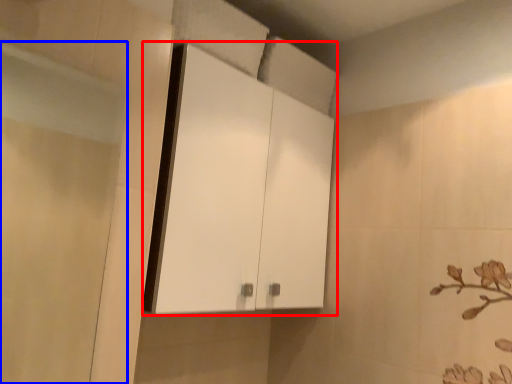
Question: Which of the following is the farthest to the observer, cabinetry (highlighted by a red box) or screen door (highlighted by a blue box)?

Choices:
 (A) cabinetry
 (B) screen door

Answer: (A)